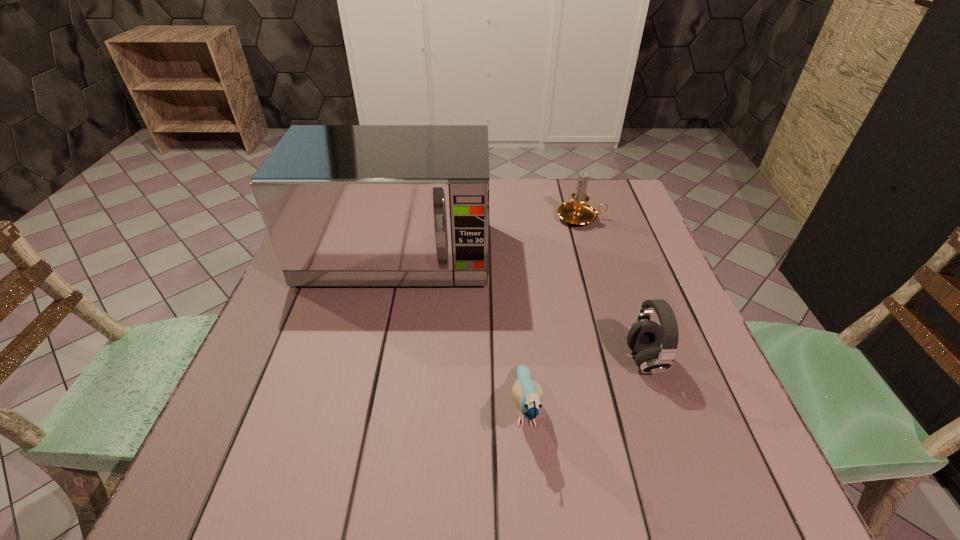
You are a GUI agent. You are given a task and a screenshot of the screen. Output one action in this format:
    pyautogui.click(x=<x>, y=<y>)
    Task: Click on the vacant area at the right edge of the desktop
    The height and width of the screenshot is (540, 960).
    Given the screenshot: What is the action you would take?
    pyautogui.click(x=614, y=315)

In the image, there is a desktop. Identify the location of free space at the near left corner. The height and width of the screenshot is (540, 960). (257, 470).

At what (x,y) coordinates should I click in order to perform the action: click on free space between the candle and the headset. Please return your answer as a coordinate pair (x, y). Looking at the image, I should click on (613, 289).

Locate an element on the screen. The width and height of the screenshot is (960, 540). blank region between the headset and the leftmost object is located at coordinates (520, 308).

Where is `free space between the bird and the microwave oven`? This screenshot has height=540, width=960. free space between the bird and the microwave oven is located at coordinates (461, 333).

I want to click on empty location between the candle and the bird, so click(x=553, y=313).

Image resolution: width=960 pixels, height=540 pixels. I want to click on vacant space in between the candle and the headset, so click(x=613, y=289).

In order to click on vacant point located between the candle and the headset in this screenshot , I will do `click(613, 289)`.

Locate an element on the screen. The image size is (960, 540). free area in between the leftmost object and the headset is located at coordinates (520, 308).

Identify the location of empty location between the headset and the third object from right to left. Image resolution: width=960 pixels, height=540 pixels. (586, 384).